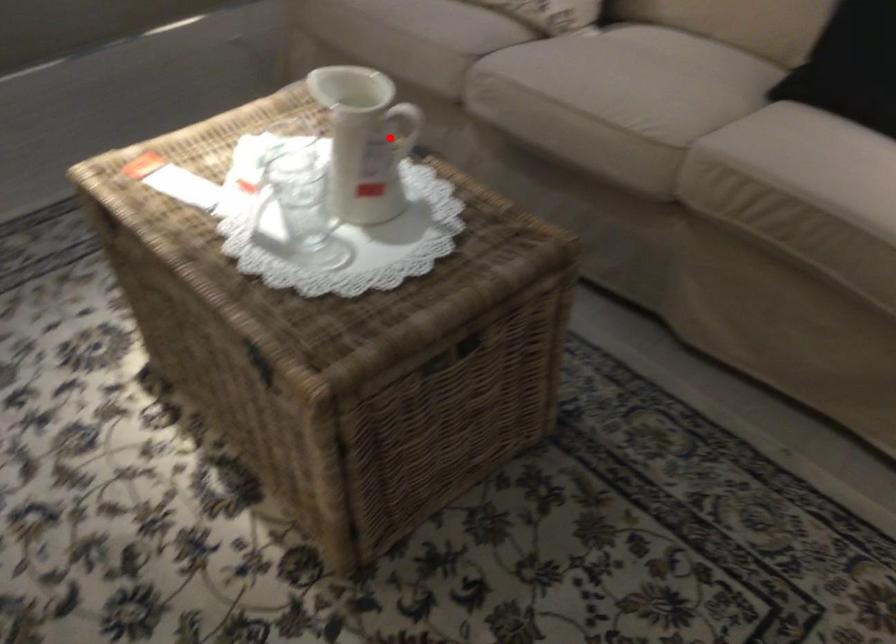
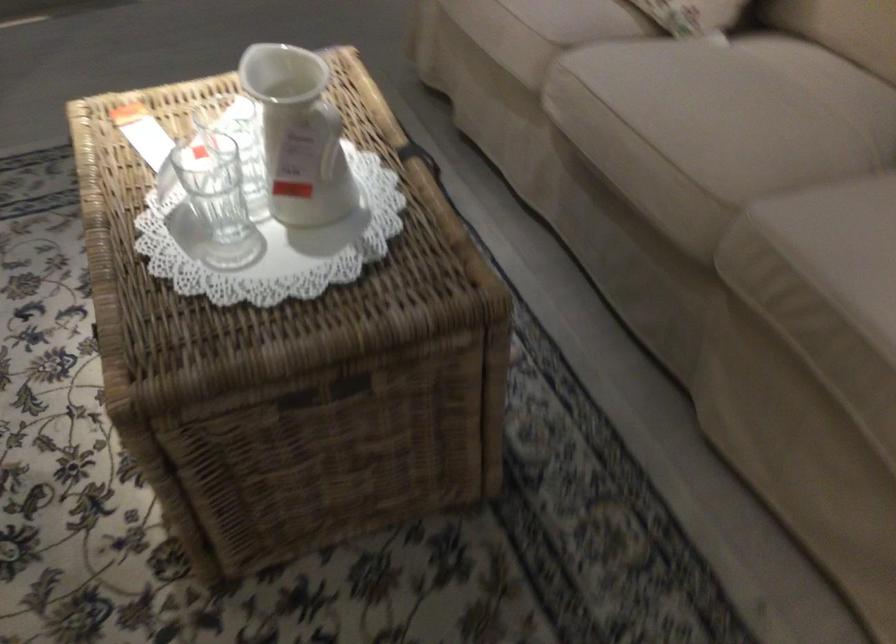
Question: I am providing you with two images of the same scene from different viewpoints. Given a red point in image1, look at the same physical point in image2. Is it:

Choices:
 (A) Closer to the viewpoint
 (B) Farther from the viewpoint

Answer: (A)